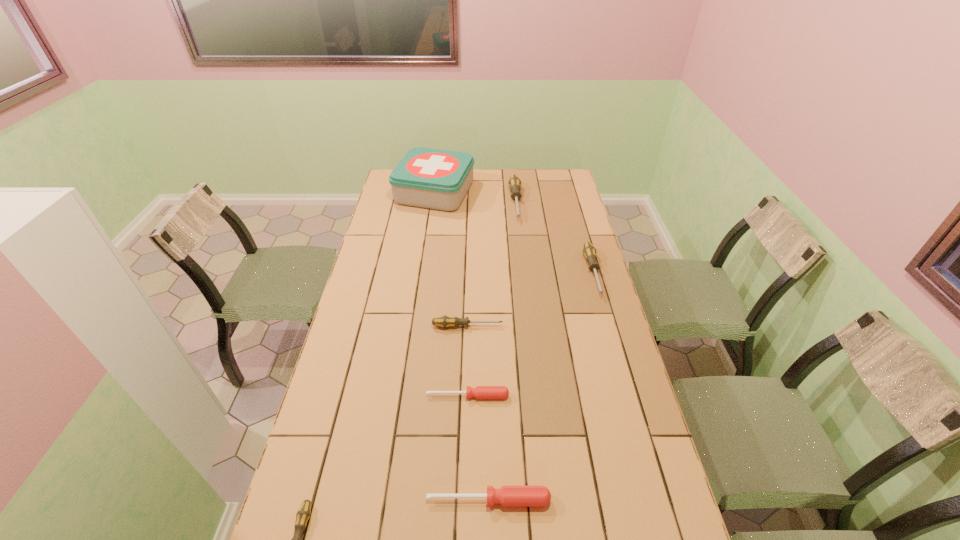
The width and height of the screenshot is (960, 540). In order to click on vacant region between the first-aid kit and the third gray screwdriver from right to left in this screenshot , I will do `click(451, 259)`.

The image size is (960, 540). I want to click on vacant area that lies between the third nearest gray screwdriver and the third farthest screwdriver, so click(x=530, y=299).

This screenshot has height=540, width=960. I want to click on object identified as the second closest to the first-aid kit, so click(x=589, y=251).

This screenshot has height=540, width=960. I want to click on the closest object to the nearer red screwdriver, so click(x=480, y=392).

Locate which screwdriver ranks in proximity to the nearer red screwdriver. Please provide its 2D coordinates. Your answer should be formatted as a tuple, i.e. [(x, y)], where the tuple contains the x and y coordinates of a point satisfying the conditions above.

[(480, 392)]

Identify which screwdriver is located as the nearest to the leftmost screwdriver. Please provide its 2D coordinates. Your answer should be formatted as a tuple, i.e. [(x, y)], where the tuple contains the x and y coordinates of a point satisfying the conditions above.

[(508, 496)]

Where is `gray screwdriver that is the third closest to the farthest screwdriver`? The width and height of the screenshot is (960, 540). gray screwdriver that is the third closest to the farthest screwdriver is located at coordinates point(304,512).

You are a GUI agent. You are given a task and a screenshot of the screen. Output one action in this format:
    pyautogui.click(x=<x>, y=<y>)
    Task: Click on the gray screwdriver that is the fourth nearest to the tallest object
    
    Given the screenshot: What is the action you would take?
    pyautogui.click(x=304, y=512)

Identify the location of red screwdriver that is the second nearest to the fifth shortest object. (508, 496).

Point out which red screwdriver is positioned as the second nearest to the first-aid kit. Please provide its 2D coordinates. Your answer should be formatted as a tuple, i.e. [(x, y)], where the tuple contains the x and y coordinates of a point satisfying the conditions above.

[(508, 496)]